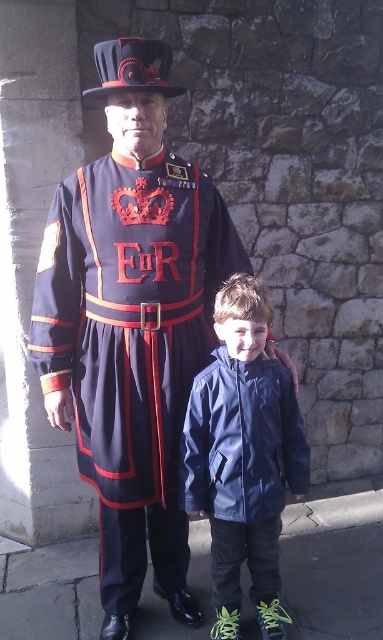
You are a photographer trying to capture a clear shot of both the matte black uniform at center and the navy blue jacket at center. Which one should you focus on first to ensure it is in sharp focus?

The matte black uniform at center is above the navy blue jacket at center, so you should focus on the matte black uniform at center first since it is closer to the camera.

You are a photographer positioned at the origin point of the image coordinate system. You need to take a photo of the matte black uniform at center. What are the coordinates where you should aim your camera?

The coordinates where you should aim your camera are at point (132, 323), as that is the 2D location of the matte black uniform at center.

You are a photographer positioned in front of the historic stone wall. You need to take a photo that includes both the matte black uniform at center and the navy blue jacket at center. Which one will appear larger in the photo?

The matte black uniform at center will appear larger in the photo because it is closer to the viewer than the navy blue jacket at center.